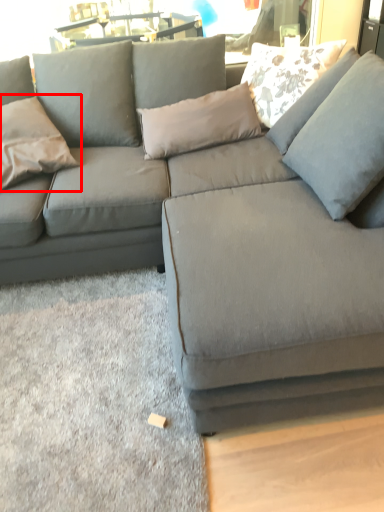
Question: Considering the relative positions of pillow (annotated by the red box) and pillow in the image provided, where is pillow (annotated by the red box) located with respect to the staircase?

Choices:
 (A) left
 (B) right

Answer: (A)